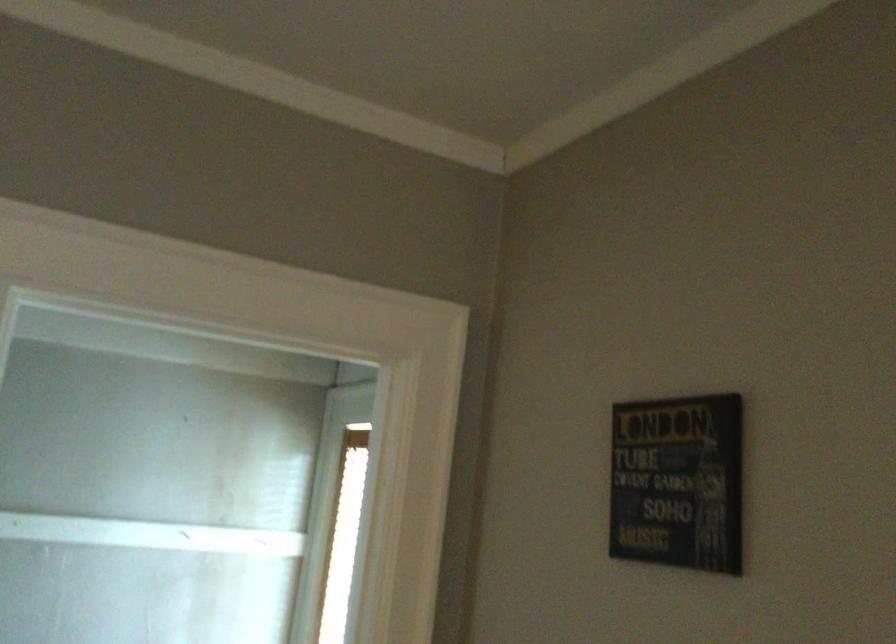
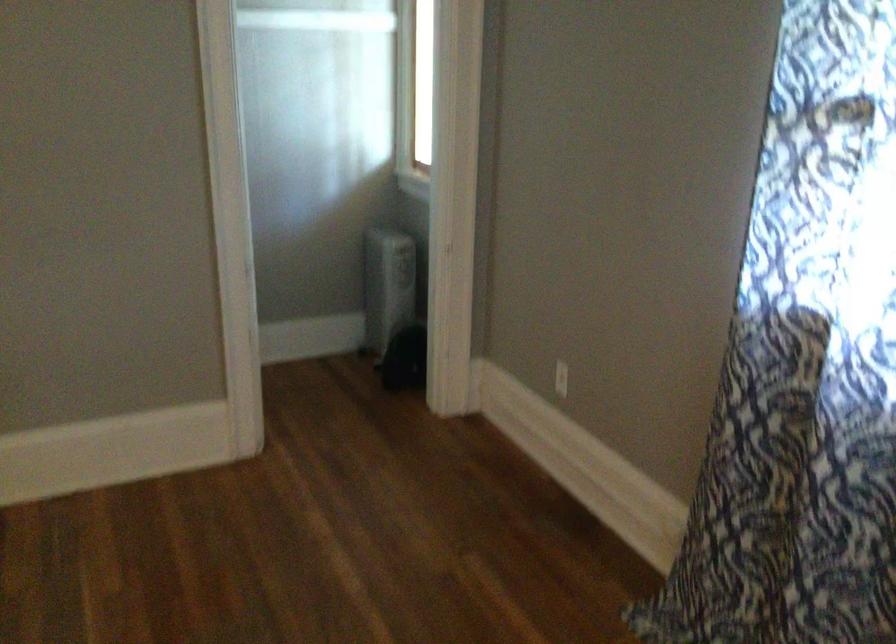
The point at (165, 525) is marked in the first image. Where is the corresponding point in the second image?

(313, 13)